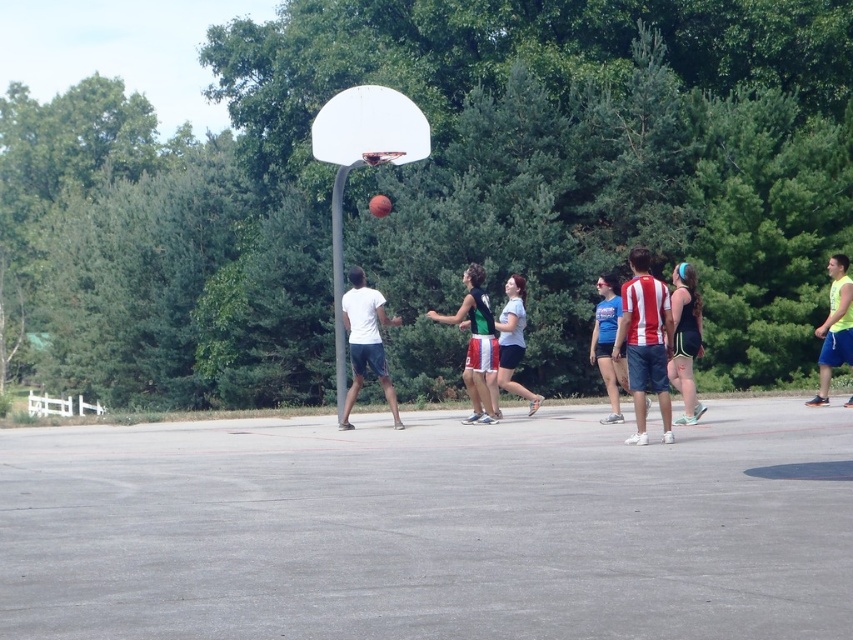
You are a photographer positioned at the back of the court. You want to capture a photo of the striped jersey shorts at center and the matte black tank top at center. Which one will appear higher in the photo?

The striped jersey shorts at center will appear higher in the photo because it is located above the matte black tank top at center.